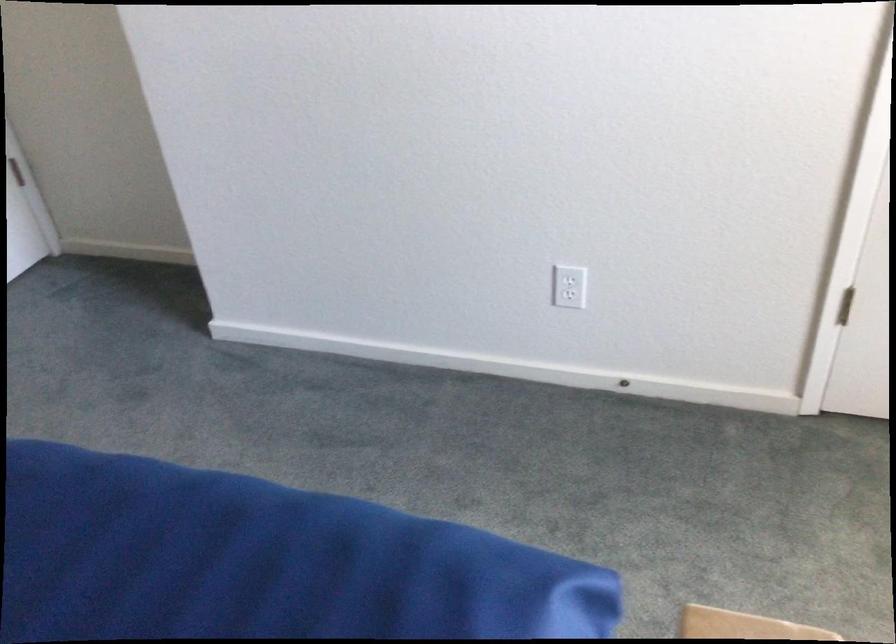
Where would you push the metal door stop? Please return your answer as a coordinate pair (x, y).

(624, 384)